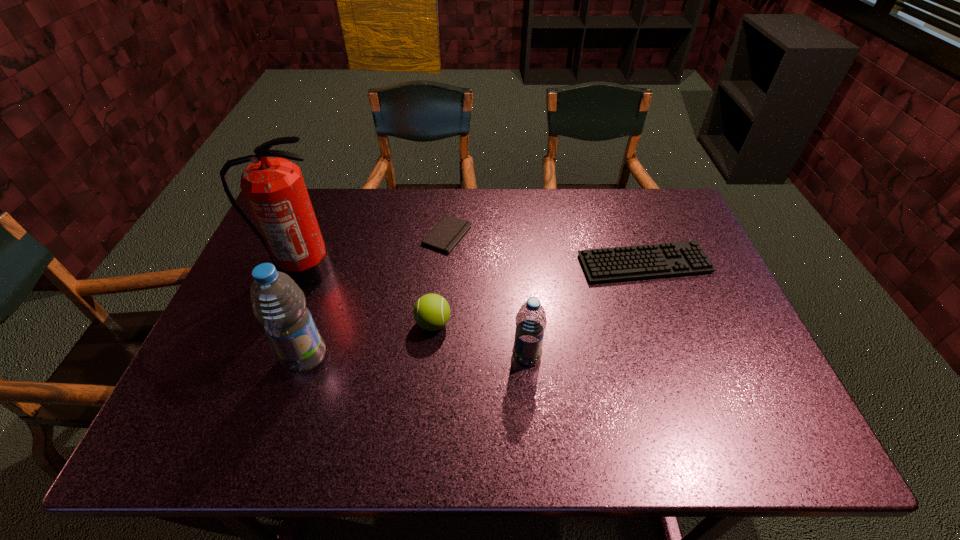
Please point out where to position a new water bottle on the right to maintain spacing. Please provide its 2D coordinates. Your answer should be formatted as a tuple, i.e. [(x, y)], where the tuple contains the x and y coordinates of a point satisfying the conditions above.

[(747, 354)]